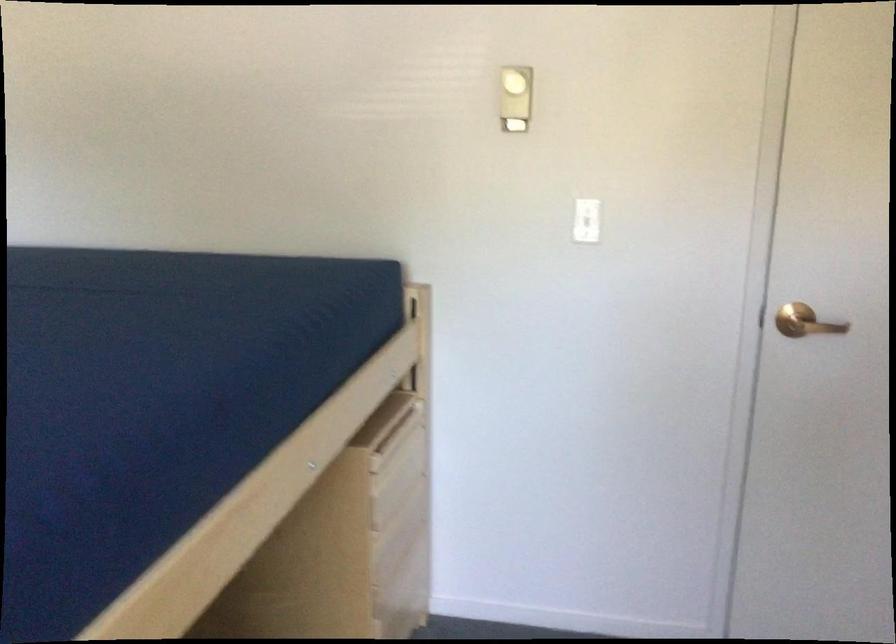
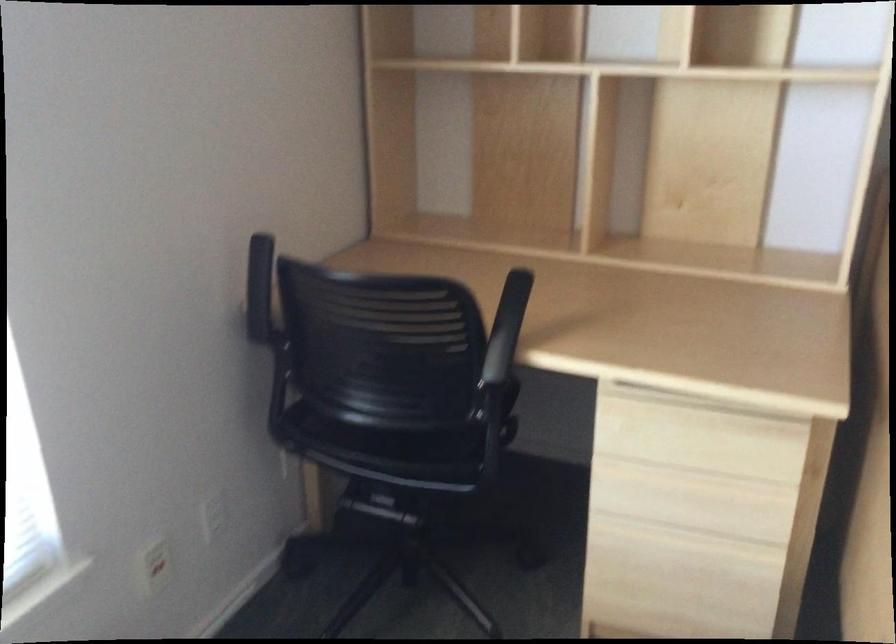
Based on the continuous images, in which direction is the camera rotating?

The camera rotated toward left-down.